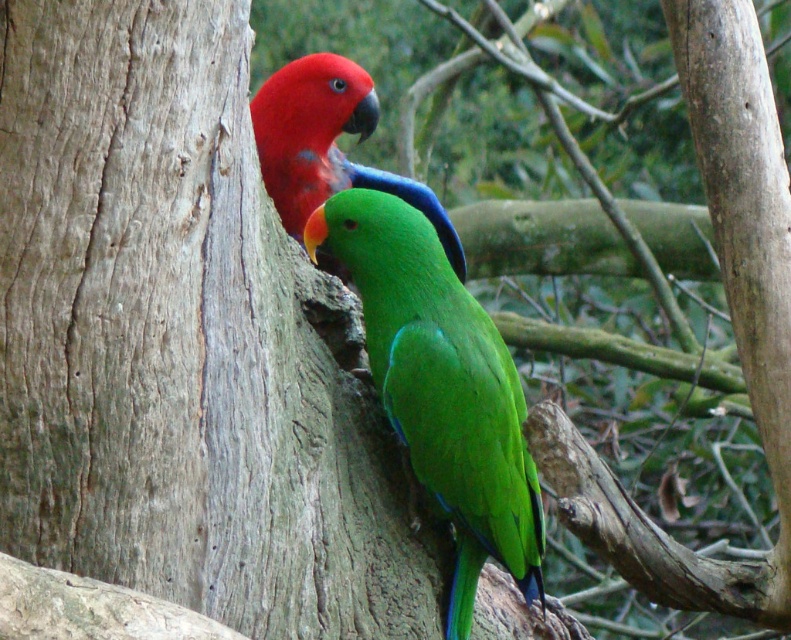
Does green glossy parrot at center appear over matte red parrot at upper left?

Actually, green glossy parrot at center is below matte red parrot at upper left.

Does green glossy parrot at center come in front of matte red parrot at upper left?

That is False.

Is point (502, 356) less distant than point (313, 189)?

Yes, point (502, 356) is in front of point (313, 189).

Where is `green glossy parrot at center`? green glossy parrot at center is located at coordinates (441, 387).